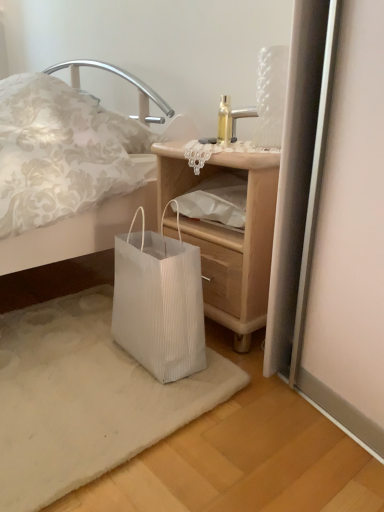
Question: From the image's perspective, is white pleated paper bag at lower left on white paper bag at lower left?

Choices:
 (A) yes
 (B) no

Answer: (B)

Question: From the image's perspective, is white pleated paper bag at lower left beneath white paper bag at lower left?

Choices:
 (A) no
 (B) yes

Answer: (B)

Question: Does white pleated paper bag at lower left have a greater height compared to white paper bag at lower left?

Choices:
 (A) no
 (B) yes

Answer: (A)

Question: Is white pleated paper bag at lower left far from white paper bag at lower left?

Choices:
 (A) no
 (B) yes

Answer: (A)

Question: From a real-world perspective, does white pleated paper bag at lower left sit lower than white paper bag at lower left?

Choices:
 (A) no
 (B) yes

Answer: (B)

Question: Is white pleated paper bag at lower left taller or shorter than white paper bag at lower left?

Choices:
 (A) short
 (B) tall

Answer: (A)

Question: Visually, is white pleated paper bag at lower left positioned to the left or to the right of white paper bag at lower left?

Choices:
 (A) left
 (B) right

Answer: (A)

Question: Relative to white paper bag at lower left, is white pleated paper bag at lower left in front or behind?

Choices:
 (A) behind
 (B) front

Answer: (B)

Question: Considering the positions of white pleated paper bag at lower left and white paper bag at lower left in the image, is white pleated paper bag at lower left bigger or smaller than white paper bag at lower left?

Choices:
 (A) big
 (B) small

Answer: (B)

Question: Is white pleated paper bag at lower left to the left or to the right of wooden nightstand at lower center in the image?

Choices:
 (A) left
 (B) right

Answer: (A)

Question: From a real-world perspective, relative to wooden nightstand at lower center, is white pleated paper bag at lower left vertically above or below?

Choices:
 (A) below
 (B) above

Answer: (A)

Question: Is white pleated paper bag at lower left taller or shorter than wooden nightstand at lower center?

Choices:
 (A) short
 (B) tall

Answer: (A)

Question: Is point (102, 349) positioned closer to the camera than point (233, 327)?

Choices:
 (A) farther
 (B) closer

Answer: (B)

Question: Is white paper bag at lower left inside the boundaries of wooden nightstand at lower center, or outside?

Choices:
 (A) outside
 (B) inside

Answer: (A)

Question: Considering the relative positions of white paper bag at lower left and wooden nightstand at lower center in the image provided, is white paper bag at lower left to the left or to the right of wooden nightstand at lower center?

Choices:
 (A) left
 (B) right

Answer: (A)